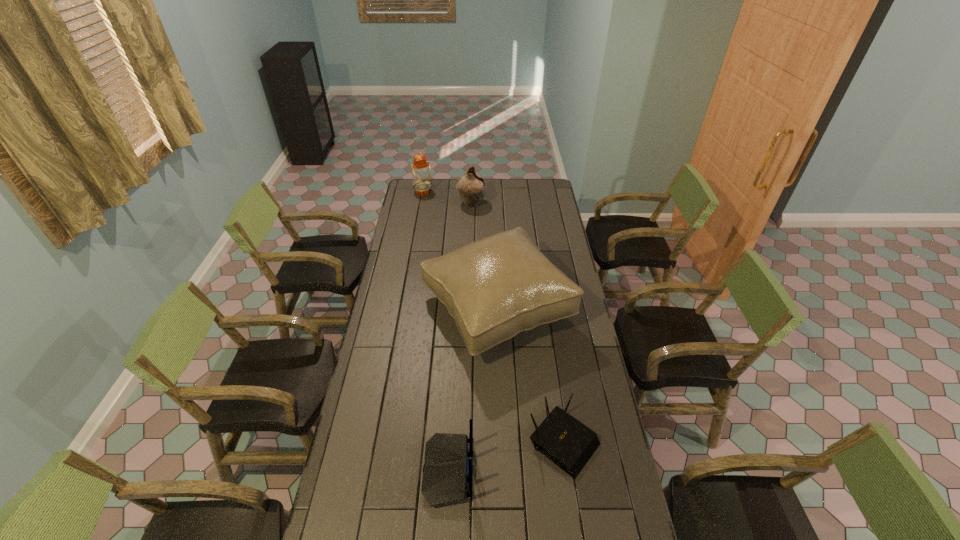
What are the coordinates of `vacant space at the right edge of the desktop` in the screenshot? It's located at (544, 211).

Where is `vacant space at the far left corner of the desktop`? vacant space at the far left corner of the desktop is located at coordinates (409, 188).

The height and width of the screenshot is (540, 960). I want to click on unoccupied area between the oil lamp and the fourth tallest object, so click(x=436, y=332).

The height and width of the screenshot is (540, 960). I want to click on unoccupied area between the third farthest object and the shorter router, so click(x=530, y=376).

This screenshot has height=540, width=960. Identify the location of vacant region between the pottery and the left router. (460, 338).

The image size is (960, 540). In order to click on unoccupied position between the cushion and the second shortest object in this screenshot , I will do `click(472, 391)`.

This screenshot has height=540, width=960. Find the location of `vacant area between the oil lamp and the pottery`. vacant area between the oil lamp and the pottery is located at coordinates (447, 198).

Where is `vacant space that's between the third tallest object and the leftmost object`? vacant space that's between the third tallest object and the leftmost object is located at coordinates (447, 198).

Where is `empty space that is in between the right router and the third farthest object`? This screenshot has width=960, height=540. empty space that is in between the right router and the third farthest object is located at coordinates (530, 376).

Select which object appears as the closest to the third farthest object. Please provide its 2D coordinates. Your answer should be formatted as a tuple, i.e. [(x, y)], where the tuple contains the x and y coordinates of a point satisfying the conditions above.

[(568, 443)]